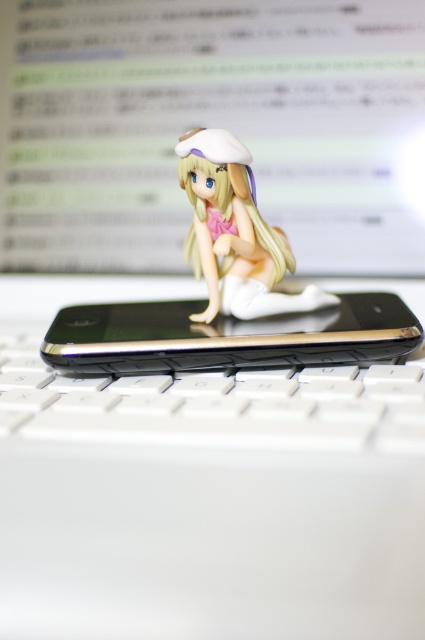
You are setting up a photo shoot and want to ensure the white plastic keyboard at center and the satin white figurine at center are both visible. Based on their positions, which object should you adjust to make sure both are in focus?

The white plastic keyboard at center is in front of the satin white figurine at center, so you should adjust the focus to include both the foreground keyboard and the slightly further figurine. Alternatively, you might reduce the distance between them to ensure both are in focus.

You are trying to place a small figurine on the keyboard without it falling off. The point where you want to place it is at point [244,349]. Given that the keyboard is 12 inches wide and 6 inches tall, will the figurine fit within the keyboard?

The point [244,349] is within the keyboard dimensions of 12 inches wide and 6 inches tall, so the figurine will fit.

You are a photographer setting up a shot of the white plastic keyboard at center. You need to position yourself exactly 24 inches away to achieve the desired depth of field. Based on the scene, is your current position too close or too far?

The white plastic keyboard at center is 22.64 inches from viewer. Since you need to be 24 inches away, you are currently too close and need to move back approximately 1.36 inches.